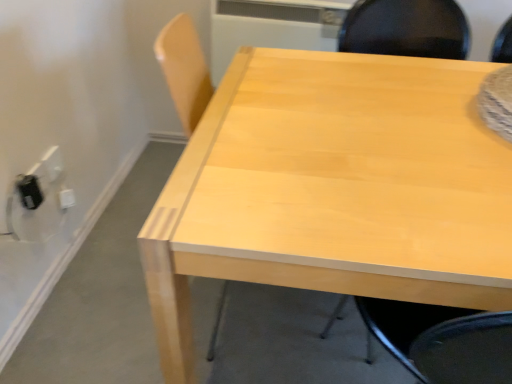
Question: From the image's perspective, does white plastic electric outlet at lower left, the second electric outlet in the front-to-back sequence, appear lower than light wood chair at upper right?

Choices:
 (A) yes
 (B) no

Answer: (B)

Question: Would you consider white plastic electric outlet at lower left, the second electric outlet in the front-to-back sequence, to be distant from light wood chair at upper right?

Choices:
 (A) yes
 (B) no

Answer: (A)

Question: Is white plastic electric outlet at lower left, marked as the first electric outlet in a back-to-front arrangement, facing away from light wood chair at upper right?

Choices:
 (A) yes
 (B) no

Answer: (B)

Question: Is white plastic electric outlet at lower left, marked as the first electric outlet in a back-to-front arrangement, not within light wood chair at upper right?

Choices:
 (A) no
 (B) yes

Answer: (B)

Question: Considering the relative sizes of white plastic electric outlet at lower left, marked as the first electric outlet in a back-to-front arrangement, and light wood chair at upper right in the image provided, is white plastic electric outlet at lower left, marked as the first electric outlet in a back-to-front arrangement, thinner than light wood chair at upper right?

Choices:
 (A) yes
 (B) no

Answer: (A)

Question: Relative to white plastic electric outlet at lower left, the second electric outlet in the front-to-back sequence, is light wood table at center in front or behind?

Choices:
 (A) behind
 (B) front

Answer: (B)

Question: From a real-world perspective, relative to white plastic electric outlet at lower left, the second electric outlet in the front-to-back sequence, is light wood table at center vertically above or below?

Choices:
 (A) above
 (B) below

Answer: (A)

Question: Is light wood table at center inside or outside of white plastic electric outlet at lower left, marked as the first electric outlet in a back-to-front arrangement?

Choices:
 (A) outside
 (B) inside

Answer: (A)

Question: From the image's perspective, is light wood table at center above or below white plastic electric outlet at lower left, marked as the first electric outlet in a back-to-front arrangement?

Choices:
 (A) below
 (B) above

Answer: (A)

Question: From the image's perspective, is white plastic electric outlet at lower left, marked as the first electric outlet in a back-to-front arrangement, above or below light wood table at center?

Choices:
 (A) below
 (B) above

Answer: (B)

Question: From their relative heights in the image, would you say white plastic electric outlet at lower left, the second electric outlet in the front-to-back sequence, is taller or shorter than light wood table at center?

Choices:
 (A) tall
 (B) short

Answer: (B)

Question: Looking at the image, does white plastic electric outlet at lower left, the second electric outlet in the front-to-back sequence, seem bigger or smaller compared to light wood table at center?

Choices:
 (A) big
 (B) small

Answer: (B)

Question: Is white plastic electric outlet at lower left, the second electric outlet in the front-to-back sequence, inside or outside of light wood table at center?

Choices:
 (A) outside
 (B) inside

Answer: (A)

Question: From a real-world perspective, is light wood table at center positioned above or below black plastic outlet at lower left, which is the 1th electric outlet from front to back?

Choices:
 (A) below
 (B) above

Answer: (A)

Question: From their relative heights in the image, would you say light wood table at center is taller or shorter than black plastic outlet at lower left, which is the 1th electric outlet from front to back?

Choices:
 (A) short
 (B) tall

Answer: (B)